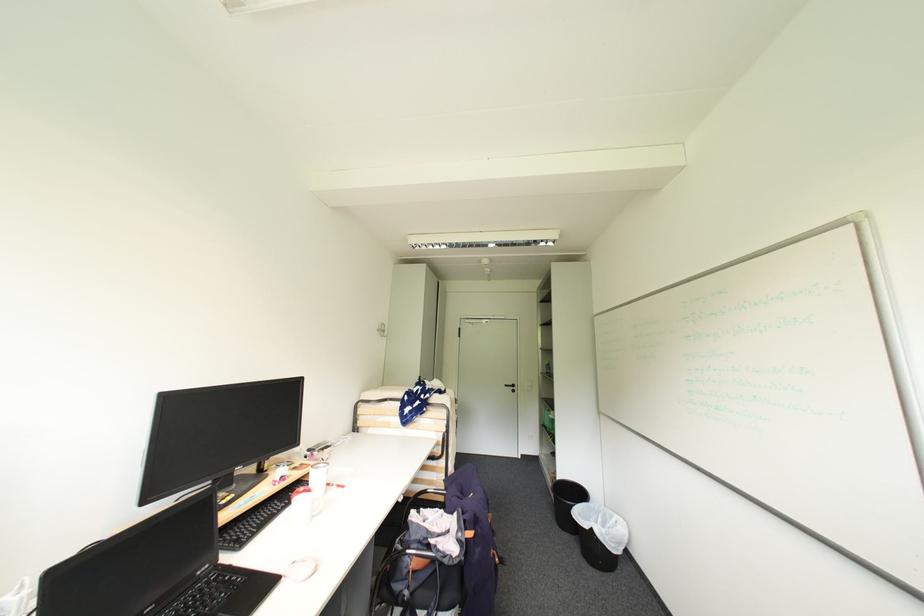
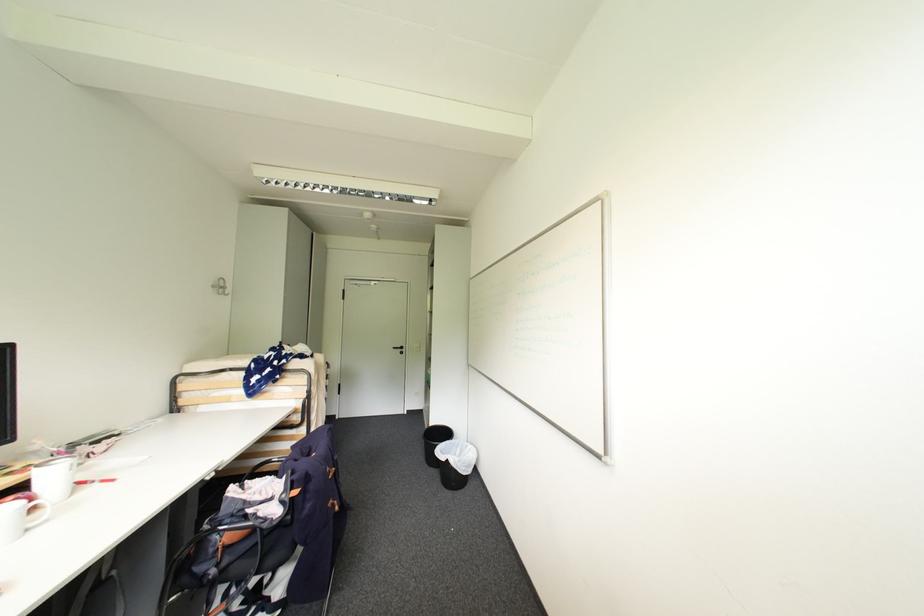
Locate, in the second image, the point that corresponds to point 384,331 in the first image.

(220, 286)